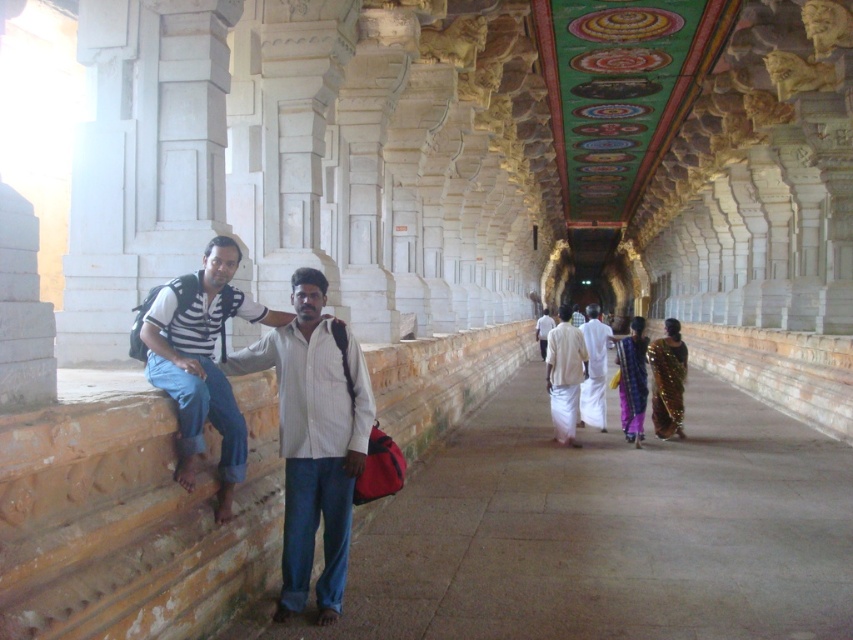
You are an anthropologist examining traditional Indian attire in a temple corridor. You notice a striped cotton shirt at left and a light beige cotton dhoti at center. Which garment is shorter in height?

The striped cotton shirt at left has a lesser height compared to the light beige cotton dhoti at center, so the striped cotton shirt at left is shorter in height.

You are an artist standing at the entrance of the temple corridor. You notice a silky gold saree at center. Where exactly is the saree positioned in relation to the corridor? Use the coordinates provided to describe its location.

The silky gold saree at center is located at coordinates point 0.594 on the x axis and 0.767 on the y axis.